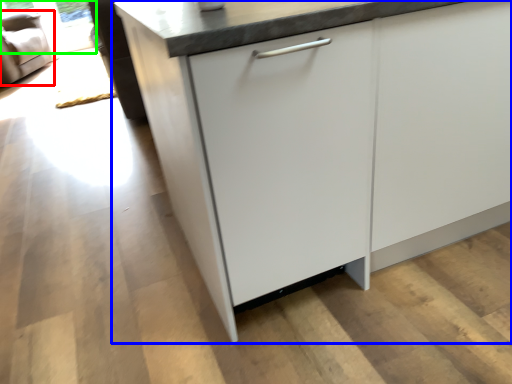
Question: Which object is the closest to the armchair (highlighted by a red box)? Choose among these: cabinetry (highlighted by a blue box) or window screen (highlighted by a green box).

Choices:
 (A) cabinetry
 (B) window screen

Answer: (B)